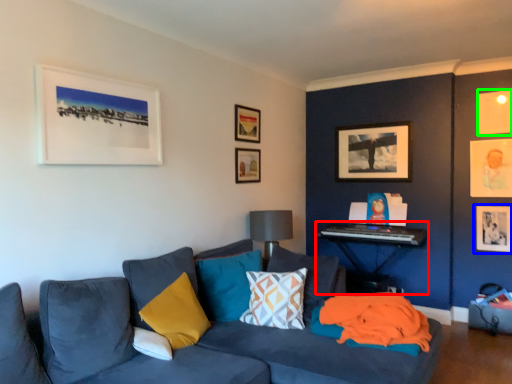
Question: Which is nearer to the table (highlighted by a red box)? picture frame (highlighted by a blue box) or picture frame (highlighted by a green box).

Choices:
 (A) picture frame
 (B) picture frame

Answer: (A)